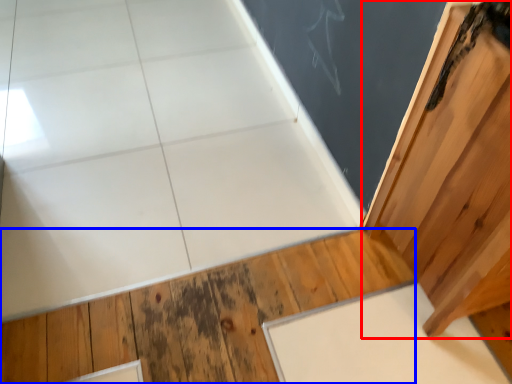
Question: Which of the following is the farthest to the observer, door (highlighted by a red box) or hardwood (highlighted by a blue box)?

Choices:
 (A) door
 (B) hardwood

Answer: (B)